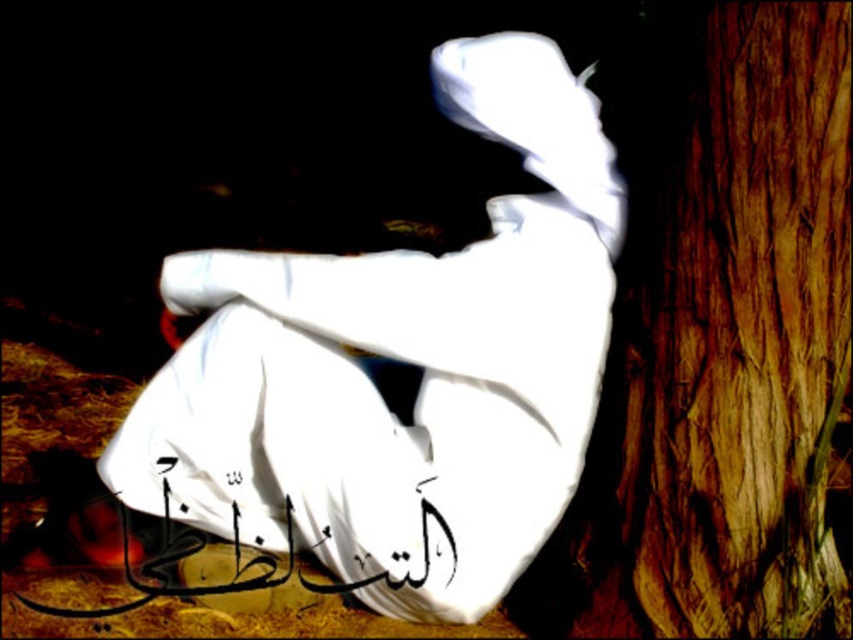
Consider the image. You are an art curator planning to display this image in a gallery. You need to ensure that the white cloth at center and the black calligraphy at lower center are visible to visitors standing at the entrance. Based on their positions, which object will appear larger to someone standing at the entrance?

The white cloth at center will appear larger because it is closer to the viewer than the black calligraphy at lower center.

You are an artist analyzing the composition of this image. The scene has a person in white sitting against a tree trunk with Arabic text at the bottom left. You notice a point at coordinates point (403, 362). What object in the image is located at this point?

The point (403, 362) corresponds to the white cloth at center.

You are an artist analyzing the composition of the image. You notice a point at coordinates (403, 362). What object is located at this point?

The point at coordinates (403, 362) corresponds to the white cloth at center.